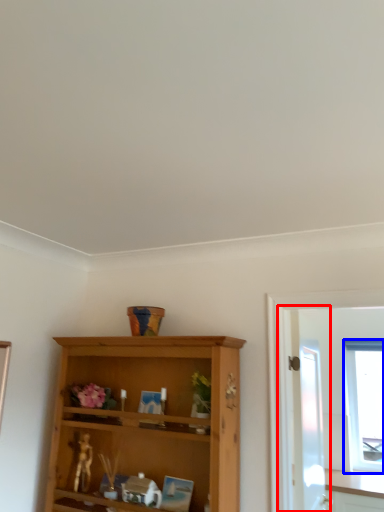
Question: Which of the following is the farthest to the observer, screen door (highlighted by a red box) or window (highlighted by a blue box)?

Choices:
 (A) screen door
 (B) window

Answer: (B)